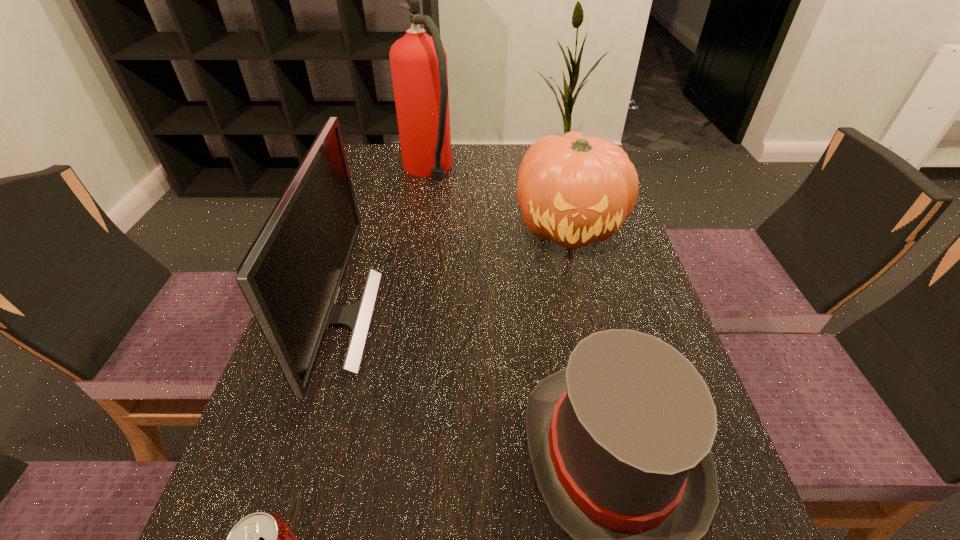
The image size is (960, 540). Find the location of `free location that satisfies the following two spatial constraints: 1. on the carved face of the third tallest object; 2. on the screen side of the monitor`. free location that satisfies the following two spatial constraints: 1. on the carved face of the third tallest object; 2. on the screen side of the monitor is located at coordinates (592, 319).